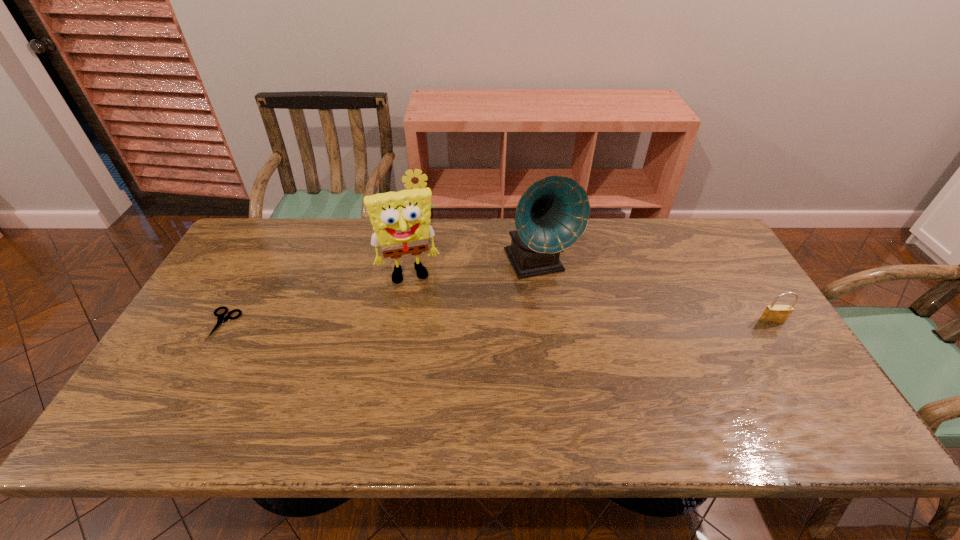
In order to click on phonograph_record present at the far edge in this screenshot , I will do `click(553, 213)`.

Where is `sunflower located at the far edge`? This screenshot has width=960, height=540. sunflower located at the far edge is located at coordinates (418, 179).

This screenshot has height=540, width=960. Find the location of `sponge that is at the far edge`. sponge that is at the far edge is located at coordinates (401, 220).

You are a GUI agent. You are given a task and a screenshot of the screen. Output one action in this format:
    pyautogui.click(x=<x>, y=<y>)
    Task: Click on the object that is at the left edge
    The height and width of the screenshot is (540, 960).
    Given the screenshot: What is the action you would take?
    pyautogui.click(x=221, y=319)

Where is `object situated at the right edge`? This screenshot has width=960, height=540. object situated at the right edge is located at coordinates (773, 314).

The width and height of the screenshot is (960, 540). I want to click on free space at the far edge of the desktop, so click(x=476, y=245).

This screenshot has height=540, width=960. In order to click on free spot at the near edge of the desktop in this screenshot , I will do `click(698, 374)`.

In the image, there is a desktop. In order to click on vacant space at the left edge in this screenshot , I will do `click(257, 287)`.

The width and height of the screenshot is (960, 540). In the image, there is a desktop. Identify the location of free space at the right edge. (744, 292).

You are a GUI agent. You are given a task and a screenshot of the screen. Output one action in this format:
    pyautogui.click(x=<x>, y=<y>)
    Task: Click on the vacant space at the far right corner of the desktop
    The height and width of the screenshot is (540, 960).
    Given the screenshot: What is the action you would take?
    click(x=697, y=230)